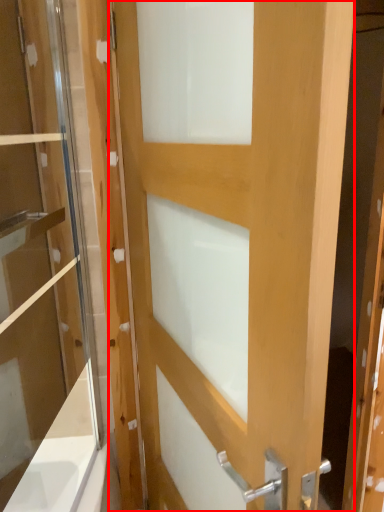
Question: From the image, what is the correct spatial relationship of door (annotated by the red box) in relation to screen door?

Choices:
 (A) right
 (B) left

Answer: (A)